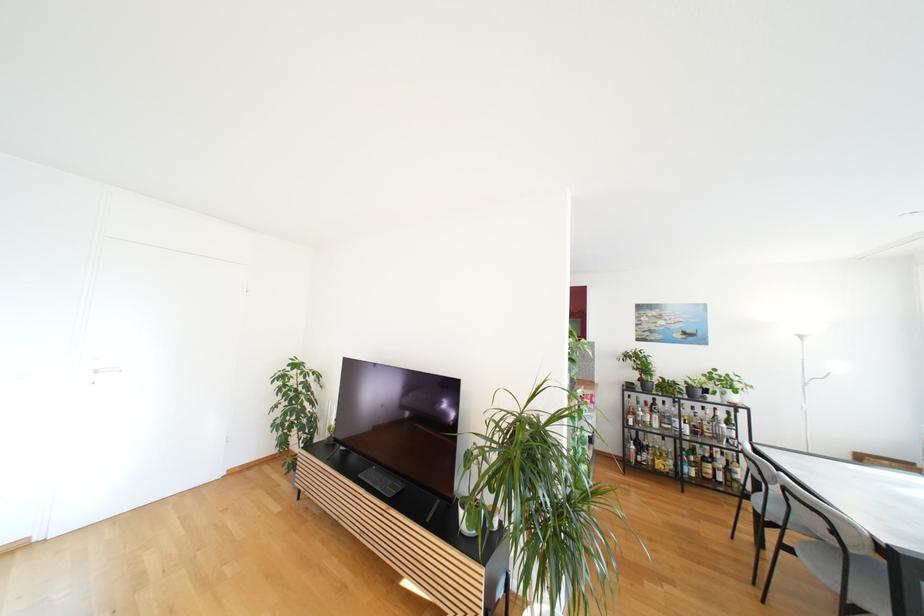
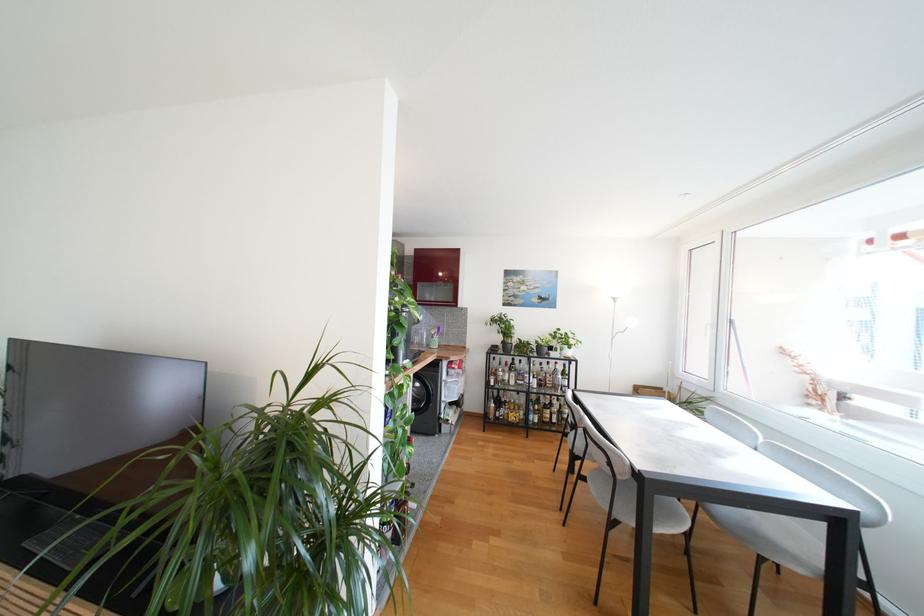
Where in the second image is the point corresponding to pixel 634 405 from the first image?

(497, 366)